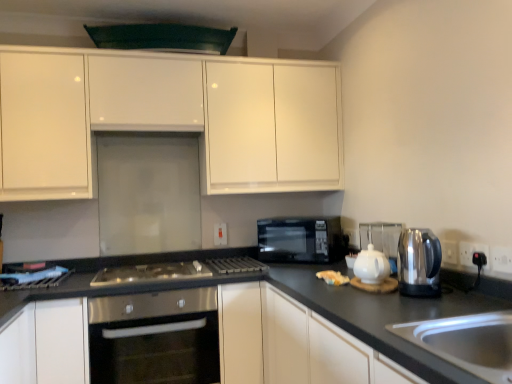
What are the coordinates of `vacant region to the left of stainless steel kettle at right` in the screenshot? It's located at (377, 304).